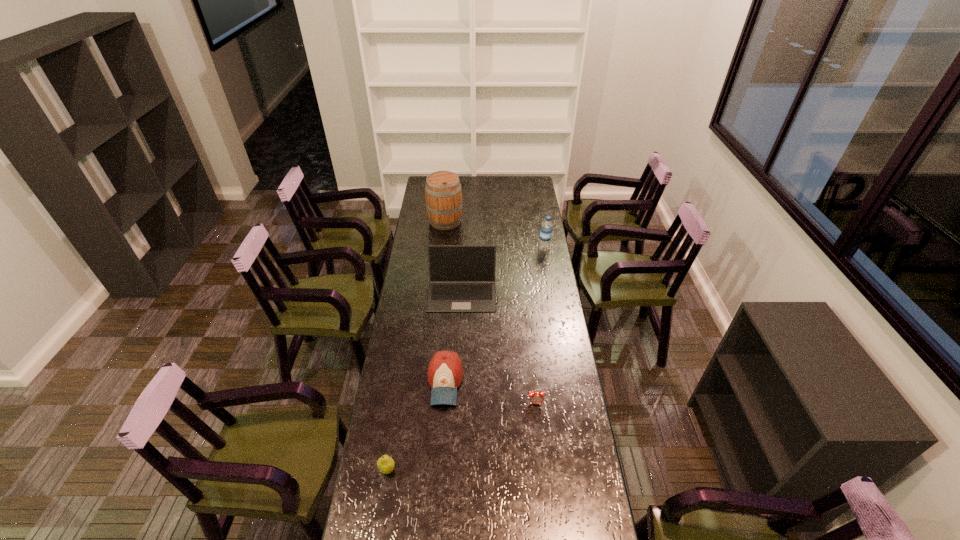
Where is `cider`? cider is located at coordinates (443, 193).

The image size is (960, 540). Identify the location of the tallest object. (443, 193).

In order to click on the rightmost object in this screenshot , I will do `click(546, 229)`.

The height and width of the screenshot is (540, 960). I want to click on the second farthest object, so click(546, 229).

Where is `laptop`? laptop is located at coordinates (461, 277).

Where is `the third shortest object`? the third shortest object is located at coordinates (445, 372).

I want to click on the fifth object from left to right, so click(536, 397).

Where is `the nearest object`? This screenshot has width=960, height=540. the nearest object is located at coordinates (385, 464).

I want to click on free space located 0.240m on the right of the tallest object, so click(504, 221).

This screenshot has width=960, height=540. In order to click on free space located 0.360m on the label of the water bottle in this screenshot , I will do `click(472, 248)`.